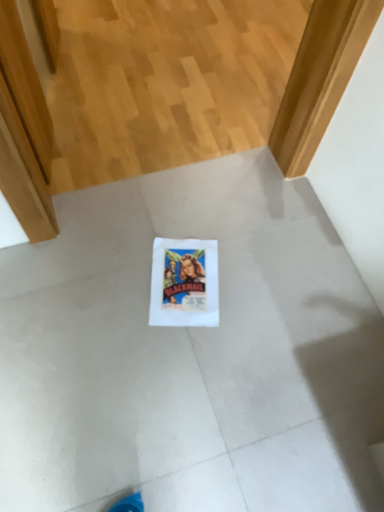
In order to face white paper flyer at center, should I rotate leftwards or rightwards?

You should look left and rotate roughly 1.257 degrees.

Describe the element at coordinates (184, 283) in the screenshot. The width and height of the screenshot is (384, 512). I see `white paper flyer at center` at that location.

Image resolution: width=384 pixels, height=512 pixels. What are the coordinates of `white paper flyer at center` in the screenshot? It's located at (184, 283).

This screenshot has width=384, height=512. Identify the location of white paper flyer at center. (184, 283).